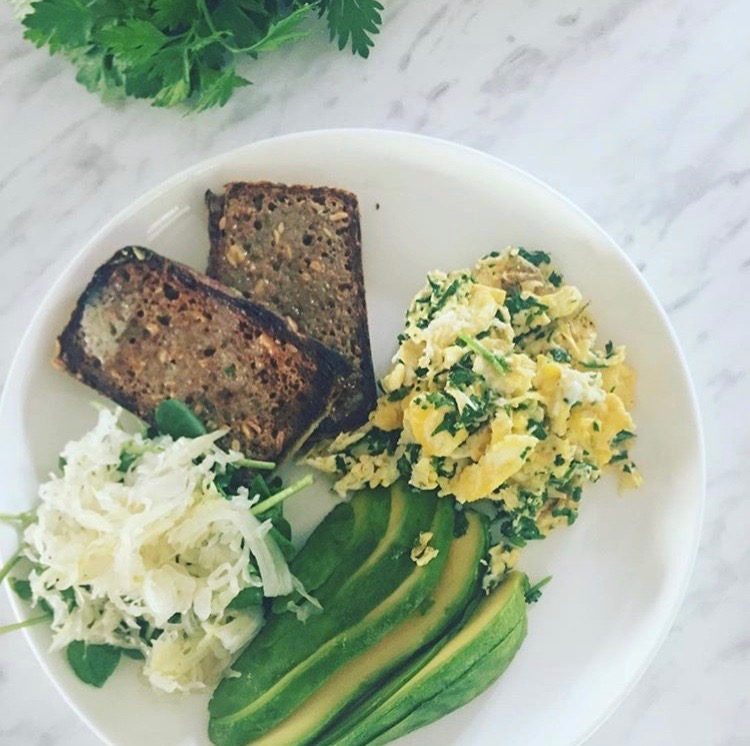
Image resolution: width=750 pixels, height=746 pixels. Identify the location of plate. (448, 184).